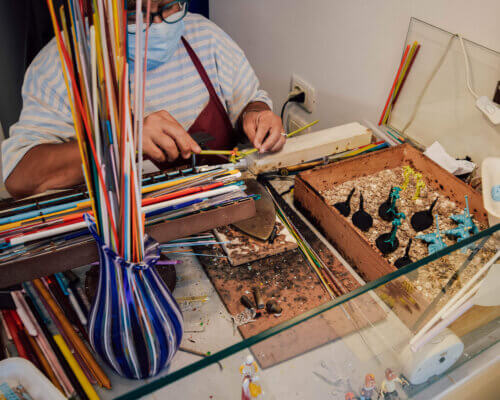
Where is `plastic/ceramic figures`? This screenshot has height=400, width=500. plastic/ceramic figures is located at coordinates (247, 378), (349, 398), (371, 387), (393, 385).